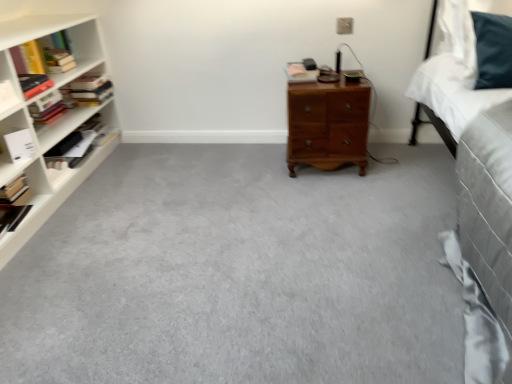
Question: Does yellow paperback book at left, which is the sixth book from right to left, have a larger size compared to hardcover book at center, marked as the 1th book in a right-to-left arrangement?

Choices:
 (A) no
 (B) yes

Answer: (B)

Question: Is yellow paperback book at left, which is the 3th book in left-to-right order, directly adjacent to hardcover book at center, acting as the 8th book starting from the left?

Choices:
 (A) no
 (B) yes

Answer: (A)

Question: From the image's perspective, is yellow paperback book at left, which is the 3th book in left-to-right order, under hardcover book at center, acting as the 8th book starting from the left?

Choices:
 (A) no
 (B) yes

Answer: (A)

Question: Can you confirm if yellow paperback book at left, which is the 3th book in left-to-right order, is shorter than hardcover book at center, acting as the 8th book starting from the left?

Choices:
 (A) yes
 (B) no

Answer: (B)

Question: From a real-world perspective, is yellow paperback book at left, which is the 3th book in left-to-right order, located higher than hardcover book at center, marked as the 1th book in a right-to-left arrangement?

Choices:
 (A) no
 (B) yes

Answer: (B)

Question: Is hardcover books at left, marked as the 4th book in a left-to-right arrangement, wider or thinner than white matte book at left, the 2th book in the right-to-left sequence?

Choices:
 (A) wide
 (B) thin

Answer: (A)

Question: Is point (96, 81) closer or farther from the camera than point (10, 142)?

Choices:
 (A) closer
 (B) farther

Answer: (B)

Question: Is hardcover books at left, marked as the 4th book in a left-to-right arrangement, to the left or to the right of white matte book at left, which appears as the seventh book when viewed from the left, in the image?

Choices:
 (A) left
 (B) right

Answer: (A)

Question: From a real-world perspective, is hardcover books at left, marked as the 4th book in a left-to-right arrangement, positioned above or below white matte book at left, the 2th book in the right-to-left sequence?

Choices:
 (A) above
 (B) below

Answer: (A)

Question: From a real-world perspective, relative to hardcover book at center, acting as the 8th book starting from the left, is hardcover book at left, placed as the 6th book when sorted from left to right, vertically above or below?

Choices:
 (A) above
 (B) below

Answer: (B)

Question: Is hardcover book at left, which ranks as the 3th book in right-to-left order, to the left or to the right of hardcover book at center, marked as the 1th book in a right-to-left arrangement, in the image?

Choices:
 (A) right
 (B) left

Answer: (B)

Question: From the image's perspective, is hardcover book at left, which ranks as the 3th book in right-to-left order, located above or below hardcover book at center, marked as the 1th book in a right-to-left arrangement?

Choices:
 (A) below
 (B) above

Answer: (A)

Question: Is hardcover book at left, placed as the 6th book when sorted from left to right, in front of or behind hardcover book at center, marked as the 1th book in a right-to-left arrangement, in the image?

Choices:
 (A) behind
 (B) front

Answer: (A)

Question: In terms of width, does hardcover books at left, which appears as the fifth book when viewed from the right, look wider or thinner when compared to hardcover book at center, acting as the 8th book starting from the left?

Choices:
 (A) wide
 (B) thin

Answer: (A)

Question: Is point (96, 84) closer or farther from the camera than point (309, 71)?

Choices:
 (A) closer
 (B) farther

Answer: (B)